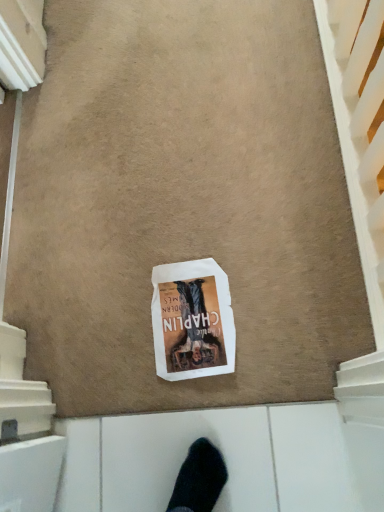
Identify the location of free space in front of white paper bag at center. (227, 389).